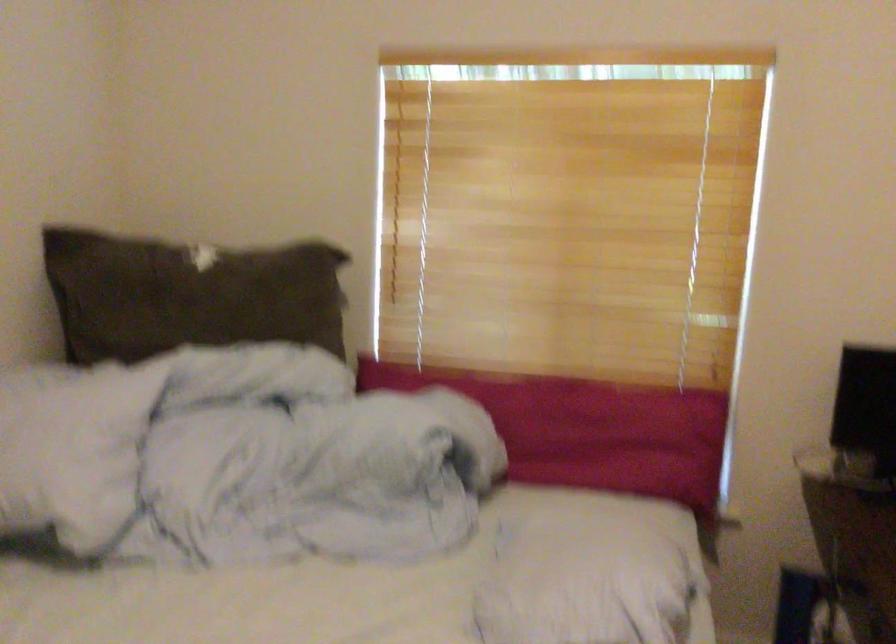
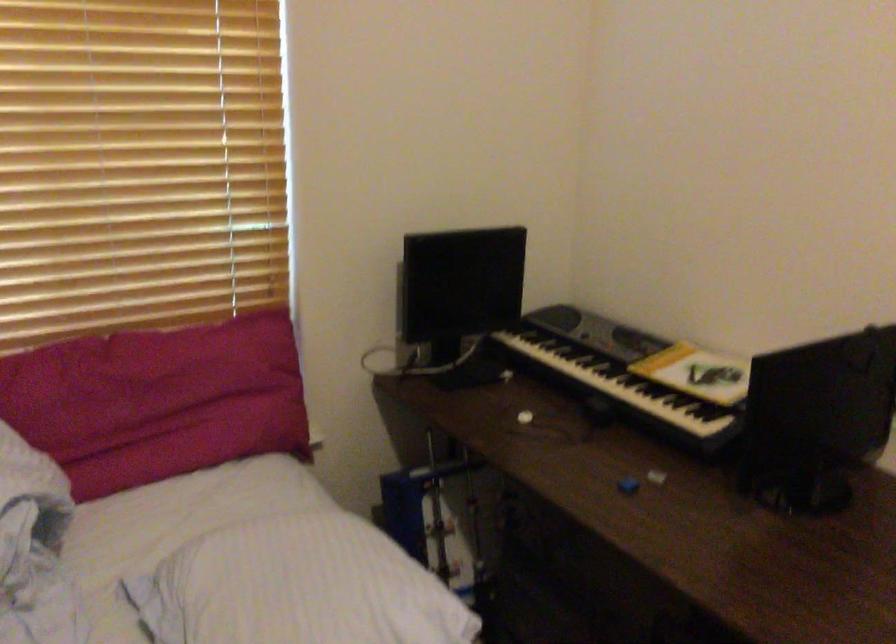
Find the pixel in the second image that matches (590,550) in the first image.

(303, 579)